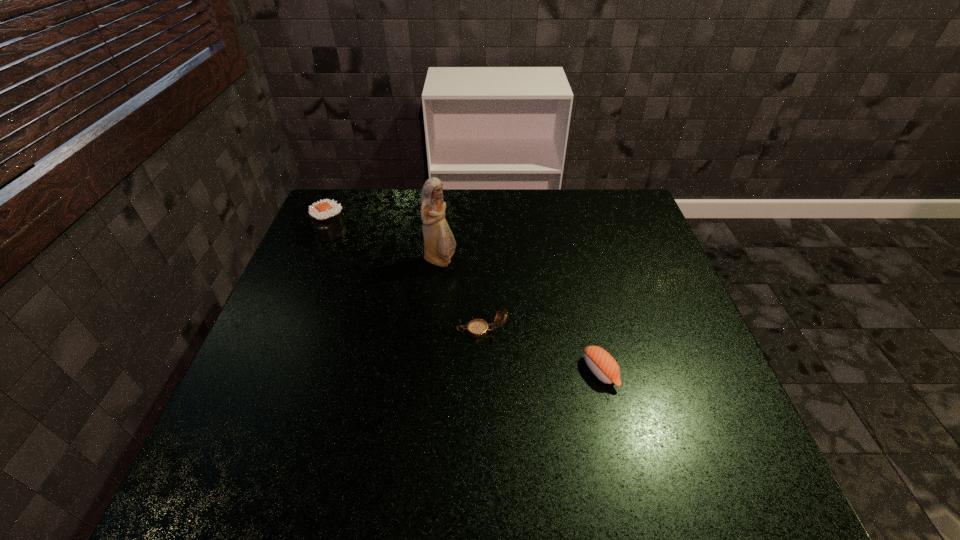
Find the location of a particular element. vacant region at the right edge of the desktop is located at coordinates (681, 321).

Identify the location of free spot at the near left corner of the desktop. This screenshot has height=540, width=960. click(280, 494).

Where is `free space between the shortest object and the third nearest object`? This screenshot has height=540, width=960. free space between the shortest object and the third nearest object is located at coordinates (520, 316).

At what (x,y) coordinates should I click in order to perform the action: click on vacant area that lies between the second farthest object and the left sushi. Please return your answer as a coordinate pair (x, y). This screenshot has width=960, height=540. Looking at the image, I should click on (386, 246).

Find the location of `vacant area between the left sushi and the second farthest object`. vacant area between the left sushi and the second farthest object is located at coordinates (386, 246).

Locate an element on the screen. This screenshot has height=540, width=960. vacant region between the second nearest object and the farther sushi is located at coordinates (407, 281).

Identify the location of free spot between the third object from left to right and the tallest object. Image resolution: width=960 pixels, height=540 pixels. (461, 296).

Locate an element on the screen. This screenshot has height=540, width=960. free space between the second object from right to left and the right sushi is located at coordinates (540, 351).

This screenshot has height=540, width=960. Find the location of `empty space between the figurine and the leftmost object`. empty space between the figurine and the leftmost object is located at coordinates (386, 246).

Where is `free spot between the tallest object and the right sushi`? The height and width of the screenshot is (540, 960). free spot between the tallest object and the right sushi is located at coordinates (520, 316).